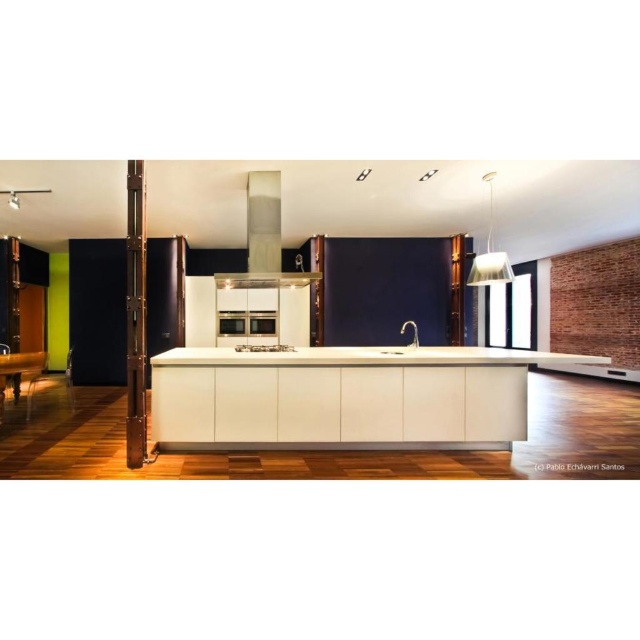
Question: Which point is closer to the camera?

Choices:
 (A) satin silver exhaust hood at upper center
 (B) satin nickel oven at center

Answer: (A)

Question: Which of the following is the farthest from the observer?

Choices:
 (A) satin silver exhaust hood at upper center
 (B) white glossy countertop at center
 (C) white glossy counter top at center

Answer: (A)

Question: Which of these objects is positioned farthest from the satin nickel oven at center?

Choices:
 (A) satin silver exhaust hood at upper center
 (B) white glossy countertop at center

Answer: (A)

Question: Does white glossy countertop at center appear over satin nickel oven at center?

Choices:
 (A) yes
 (B) no

Answer: (B)

Question: Is white glossy countertop at center to the left of satin silver exhaust hood at upper center from the viewer's perspective?

Choices:
 (A) no
 (B) yes

Answer: (A)

Question: Does white glossy counter top at center have a smaller size compared to satin silver exhaust hood at upper center?

Choices:
 (A) yes
 (B) no

Answer: (B)